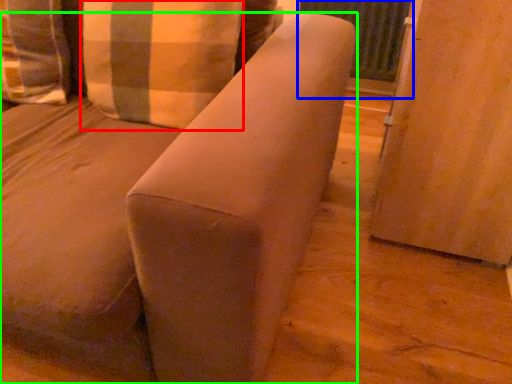
Question: Which object is the farthest from pillow (highlighted by a red box)? Choose among these: screen door (highlighted by a blue box) or furniture (highlighted by a green box).

Choices:
 (A) screen door
 (B) furniture

Answer: (A)